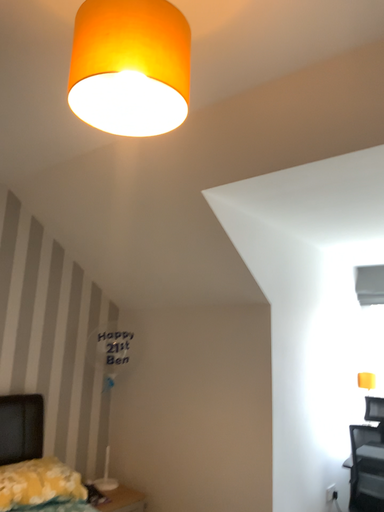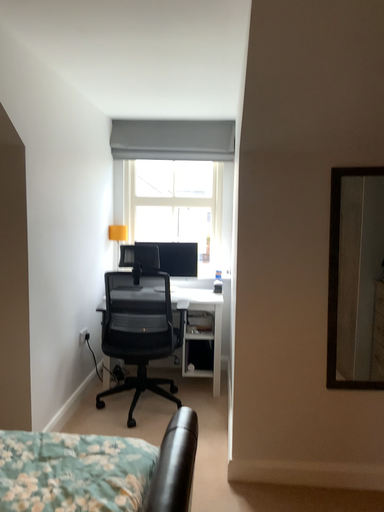
Question: How did the camera likely rotate when shooting the video?

Choices:
 (A) rotated left
 (B) rotated right

Answer: (B)